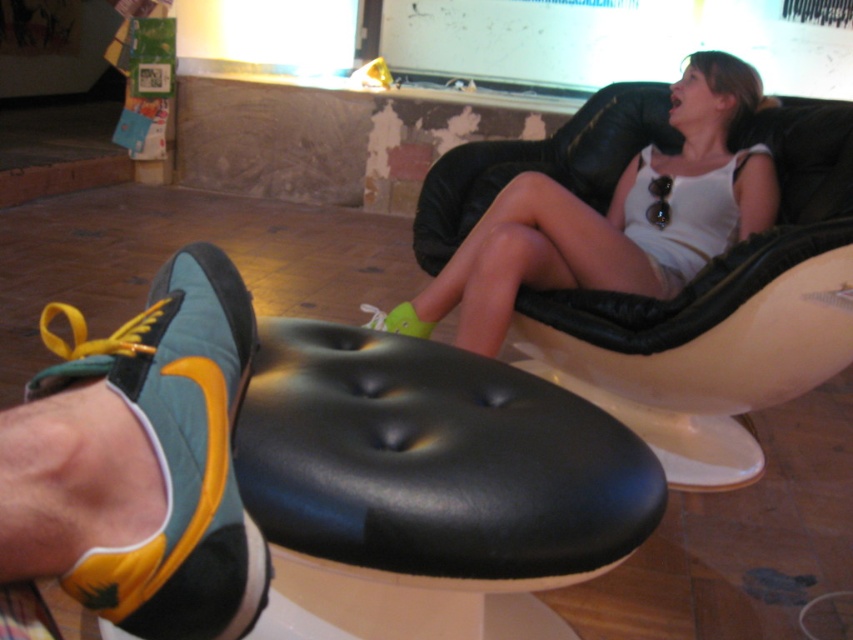
You are a delivery robot with a width of 1 meter. You need to navigate between the green suede shoe at lower left and the green suede shoe at lower center to reach the delivery point. Can you fit through the space between them?

The distance between the green suede shoe at lower left and the green suede shoe at lower center is 1.46 meters. Since the robot is 1 meter wide, it can fit through the space as the width is sufficient.

You are standing in the room and want to determine which of the two points, point (173,516) or point (407,310), is closer to you. Based on the scene description, which point is nearer?

Point (173,516) is closer to the viewer than point (407,310).

You are standing at the origin point of the image coordinate system. The black leather footrest at lower center is located at point 0.745, 0.506. If you want to walk towards it, in which direction should you move?

Since the black leather footrest at lower center is located at coordinates (431, 476), which is to the right and slightly above the center, you should move towards the right and slightly upward to reach it.